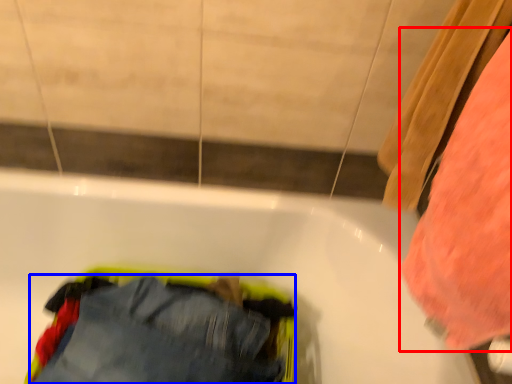
Question: Which point is further to the camera, clothing (highlighted by a red box) or trousers (highlighted by a blue box)?

Choices:
 (A) clothing
 (B) trousers

Answer: (B)